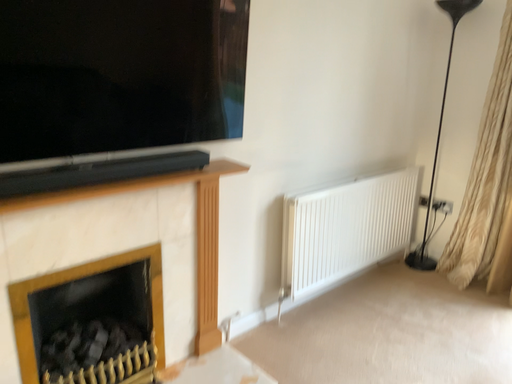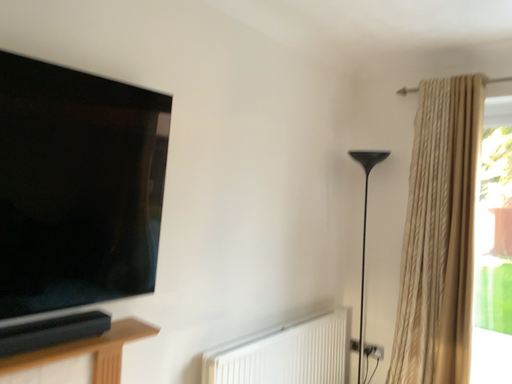
Question: Which way did the camera rotate in the video?

Choices:
 (A) rotated downward
 (B) rotated upward

Answer: (B)